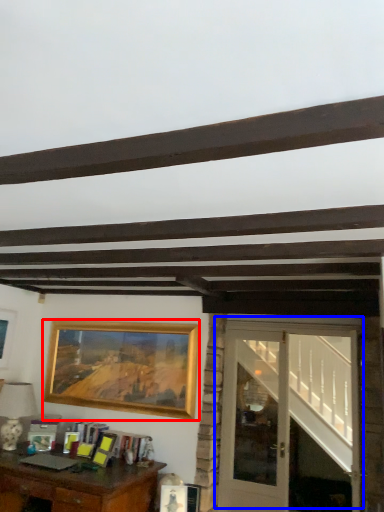
Question: Among these objects, which one is farthest to the camera, picture frame (highlighted by a red box) or door (highlighted by a blue box)?

Choices:
 (A) picture frame
 (B) door

Answer: (A)